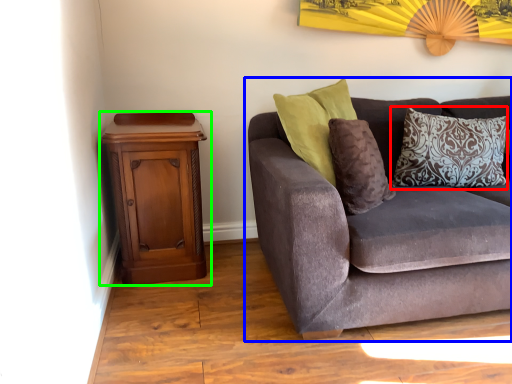
Question: Based on their relative distances, which object is nearer to pillow (highlighted by a red box)? Choose from studio couch (highlighted by a blue box) and nightstand (highlighted by a green box).

Choices:
 (A) studio couch
 (B) nightstand

Answer: (A)